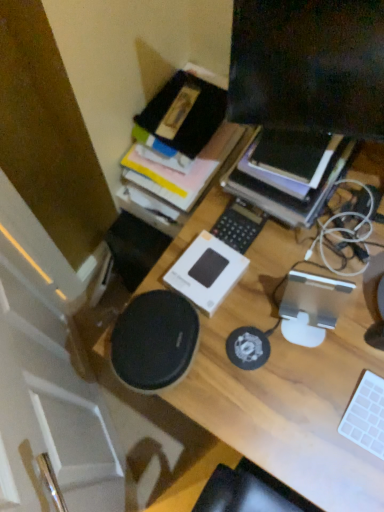
I want to click on vacant space situated on the left part of white matte keyboard at lower right, acting as the second laptop keyboard starting from the back, so click(x=316, y=435).